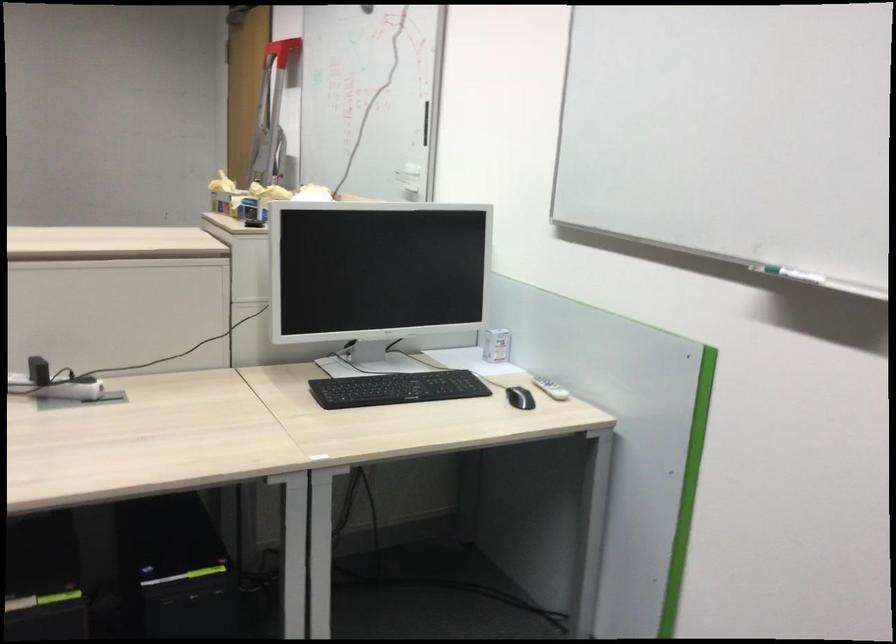
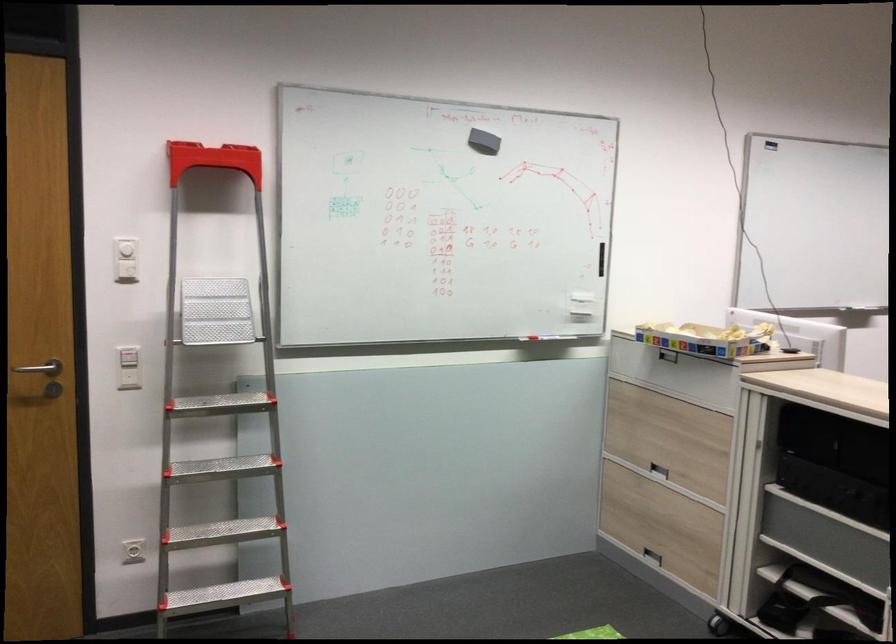
Question: I am providing you with two images of the same scene from different viewpoints. After the viewpoint changes to image2, which objects are now occluded?

Choices:
 (A) black pen cap
 (B) white wall dial
 (C) white remote control
 (D) red whiteboard marker

Answer: (C)